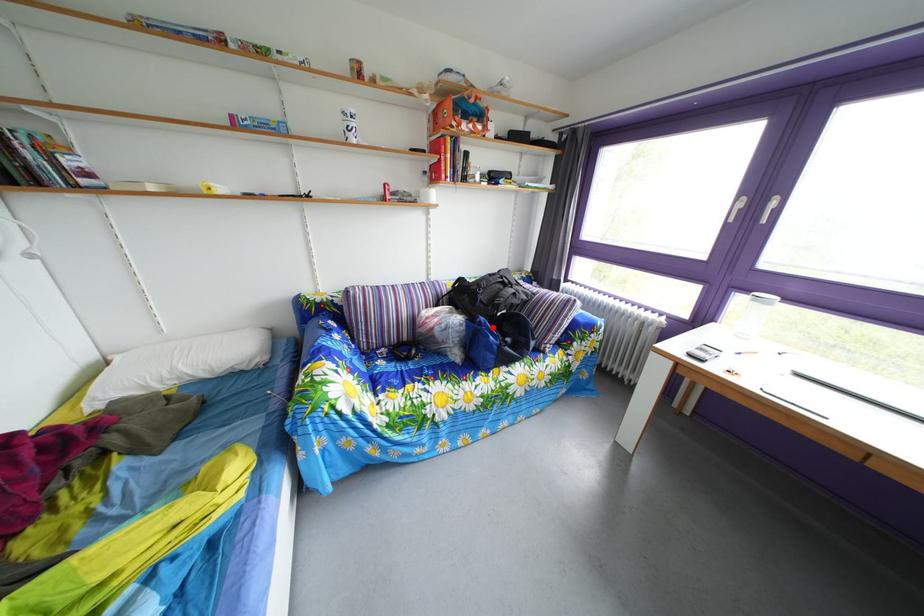
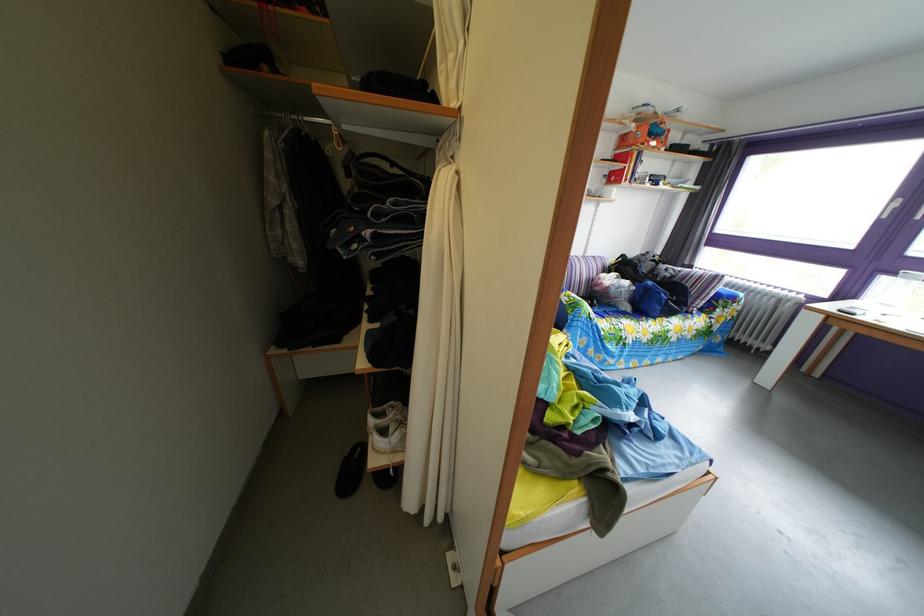
In the second image, find the point that corresponds to the highlighted location in the first image.

(661, 291)